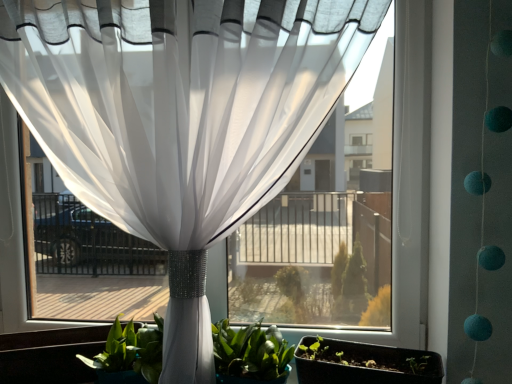
Question: Is matte black flowerpot at lower right not inside green leafy plant at center?

Choices:
 (A) no
 (B) yes

Answer: (B)

Question: Considering the relative sizes of matte black flowerpot at lower right and green leafy plant at center in the image provided, is matte black flowerpot at lower right bigger than green leafy plant at center?

Choices:
 (A) yes
 (B) no

Answer: (B)

Question: From the image's perspective, would you say matte black flowerpot at lower right is shown under green leafy plant at center?

Choices:
 (A) yes
 (B) no

Answer: (A)

Question: Would you consider matte black flowerpot at lower right to be distant from green leafy plant at center?

Choices:
 (A) no
 (B) yes

Answer: (A)

Question: Could you tell me if matte black flowerpot at lower right is turned towards green leafy plant at center?

Choices:
 (A) no
 (B) yes

Answer: (A)

Question: Does matte black flowerpot at lower right lie behind green leafy plant at center?

Choices:
 (A) no
 (B) yes

Answer: (A)

Question: Is green leafy plant at center in contact with matte black flowerpot at lower right?

Choices:
 (A) yes
 (B) no

Answer: (B)

Question: Is green leafy plant at center facing towards matte black flowerpot at lower right?

Choices:
 (A) yes
 (B) no

Answer: (B)

Question: Is green leafy plant at center wider than matte black flowerpot at lower right?

Choices:
 (A) no
 (B) yes

Answer: (B)

Question: Does green leafy plant at center have a lesser width compared to matte black flowerpot at lower right?

Choices:
 (A) no
 (B) yes

Answer: (A)

Question: Does green leafy plant at center come behind matte black flowerpot at lower right?

Choices:
 (A) no
 (B) yes

Answer: (B)

Question: Would you say green leafy plant at center is a long distance from matte black flowerpot at lower right?

Choices:
 (A) yes
 (B) no

Answer: (B)

Question: Is green leafy plant at center in front of or behind matte black flowerpot at lower right in the image?

Choices:
 (A) behind
 (B) front

Answer: (A)